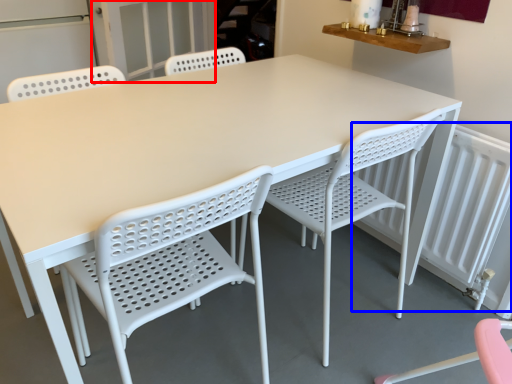
Question: Which point is closer to the camera, screen door (highlighted by a red box) or radiator (highlighted by a blue box)?

Choices:
 (A) screen door
 (B) radiator

Answer: (B)